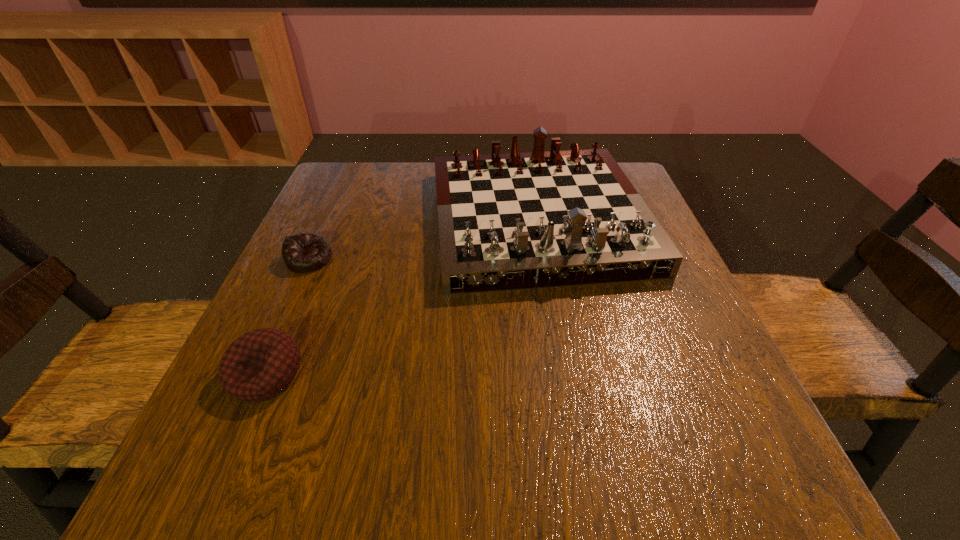
This screenshot has height=540, width=960. I want to click on object located at the right edge, so click(x=515, y=221).

The height and width of the screenshot is (540, 960). In order to click on object located at the far right corner in this screenshot , I will do `click(515, 221)`.

Identify the location of vacant space at the far edge. The image size is (960, 540). (418, 199).

At what (x,y) coordinates should I click in order to perform the action: click on free space at the near edge of the desktop. Please return your answer as a coordinate pair (x, y). Looking at the image, I should click on (375, 449).

Identify the location of free spot at the left edge of the desktop. This screenshot has height=540, width=960. point(322,233).

The width and height of the screenshot is (960, 540). What are the coordinates of `vacant space at the right edge of the desktop` in the screenshot? It's located at (632, 384).

Locate an element on the screen. Image resolution: width=960 pixels, height=540 pixels. vacant area at the far left corner is located at coordinates (373, 171).

I want to click on free location at the near left corner of the desktop, so click(164, 504).

Locate an element on the screen. vacant region at the near right corner of the desktop is located at coordinates (684, 482).

This screenshot has height=540, width=960. Identify the location of unoccupied position between the gameboard and the shorter beanbag. (423, 239).